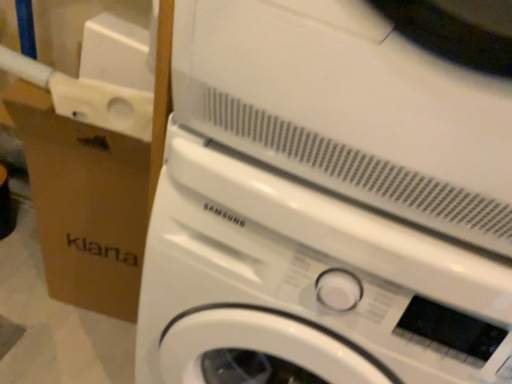
What do you see at coordinates (331, 198) in the screenshot? The height and width of the screenshot is (384, 512). I see `white glossy washing machine at center` at bounding box center [331, 198].

Image resolution: width=512 pixels, height=384 pixels. What are the coordinates of `white glossy washing machine at center` in the screenshot? It's located at (331, 198).

Where is `brown cardboard at left`? brown cardboard at left is located at coordinates (93, 182).

Measure the distance between point [48,206] and camera.

Point [48,206] is 1.10 meters from camera.

What is the approximate height of brown cardboard at left?

It is 29.60 inches.

In order to face brown cardboard at left, should I rotate leftwards or rightwards?

Turn left approximately 19.859 degrees to face it.

Describe the element at coordinates (93, 182) in the screenshot. I see `brown cardboard at left` at that location.

Identify the location of white glossy washing machine at center. (331, 198).

Can you confirm if brown cardboard at left is positioned to the left of white glossy washing machine at center?

Correct, you'll find brown cardboard at left to the left of white glossy washing machine at center.

Is brown cardboard at left positioned behind white glossy washing machine at center?

Yes, brown cardboard at left is further from the camera.

Does point (30, 97) lie behind point (387, 159)?

Yes, it is.

From the image's perspective, is brown cardboard at left on top of white glossy washing machine at center?

Yes, from the image's perspective, brown cardboard at left is above white glossy washing machine at center.

From a real-world perspective, between brown cardboard at left and white glossy washing machine at center, who is vertically higher?

white glossy washing machine at center.

Looking at their sizes, would you say brown cardboard at left is wider or thinner than white glossy washing machine at center?

Considering their sizes, brown cardboard at left looks slimmer than white glossy washing machine at center.

Which of these two, brown cardboard at left or white glossy washing machine at center, stands shorter?

Standing shorter between the two is brown cardboard at left.

Considering the relative sizes of brown cardboard at left and white glossy washing machine at center in the image provided, is brown cardboard at left bigger than white glossy washing machine at center?

No.

Is brown cardboard at left completely or partially outside of white glossy washing machine at center?

Yes.

Is brown cardboard at left not close to white glossy washing machine at center?

That's not correct — brown cardboard at left is a little close to white glossy washing machine at center.

Is brown cardboard at left oriented towards white glossy washing machine at center?

No, brown cardboard at left is not turned towards white glossy washing machine at center.

Find the location of `washing machine located in front of the brown cardboard at left`. washing machine located in front of the brown cardboard at left is located at coordinates (331, 198).

Is white glossy washing machine at center at the right side of brown cardboard at left?

Yes, white glossy washing machine at center is to the right of brown cardboard at left.

Between white glossy washing machine at center and brown cardboard at left, which one is positioned behind?

Positioned behind is brown cardboard at left.

Considering the positions of points (382, 136) and (104, 273), is point (382, 136) farther from camera compared to point (104, 273)?

No, (382, 136) is closer to viewer.

From the image's perspective, is white glossy washing machine at center located above or below brown cardboard at left?

Clearly, from the image's perspective, white glossy washing machine at center is below brown cardboard at left.

From a real-world perspective, which is physically above, white glossy washing machine at center or brown cardboard at left?

In real-world perspective, white glossy washing machine at center is above.

Which object is wider, white glossy washing machine at center or brown cardboard at left?

white glossy washing machine at center is wider.

Can you confirm if white glossy washing machine at center is shorter than brown cardboard at left?

No.

Considering the sizes of white glossy washing machine at center and brown cardboard at left in the image, is white glossy washing machine at center bigger or smaller than brown cardboard at left?

Considering their sizes, white glossy washing machine at center takes up more space than brown cardboard at left.

Consider the image. Does white glossy washing machine at center contain brown cardboard at left?

No, brown cardboard at left is not inside white glossy washing machine at center.

Is white glossy washing machine at center positioned far away from brown cardboard at left?

No, white glossy washing machine at center is not far away from brown cardboard at left.

Is white glossy washing machine at center turned away from brown cardboard at left?

No, white glossy washing machine at center is not facing the opposite direction of brown cardboard at left.

The width and height of the screenshot is (512, 384). I want to click on washing machine below the brown cardboard at left (from the image's perspective), so click(331, 198).

There is a brown cardboard at left. Find the location of `washing machine above it (from a real-world perspective)`. washing machine above it (from a real-world perspective) is located at coordinates (331, 198).

The height and width of the screenshot is (384, 512). I want to click on washing machine on the right of brown cardboard at left, so pyautogui.click(x=331, y=198).